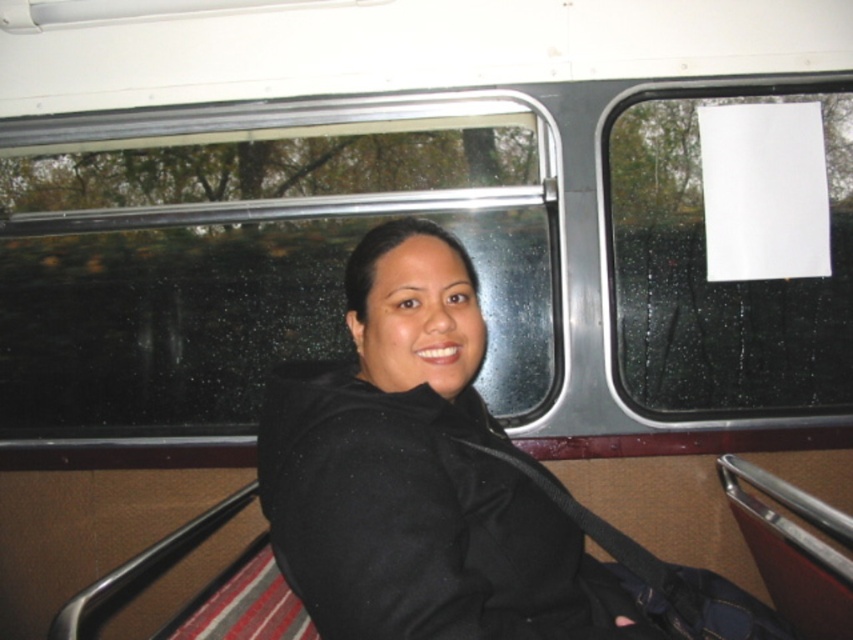
You are inside a moving vehicle and want to look outside through the transparent glass window at upper center. Where exactly should you look to see the view outside?

You should look at point (251, 260) on the transparent glass window at upper center to see the view outside.

You are a passenger on a moving vehicle and need to place a small item on the seat next to you. The seat has limited space. Which object, the black matte jacket at center or the white paper at upper right, would you choose to place the item on, considering their sizes?

The black matte jacket at center is shorter than the white paper at upper right, so the white paper at upper right has more space and would be a better choice for placing the small item.

You are a passenger on a moving vehicle and want to check the weather outside. You have a transparent glass window at upper center and a black matte jacket at center. Which object should you look through to see the outside environment?

You should look through the transparent glass window at upper center to see the outside environment because it is positioned to the left of the black matte jacket at center, allowing for a clear view outside.